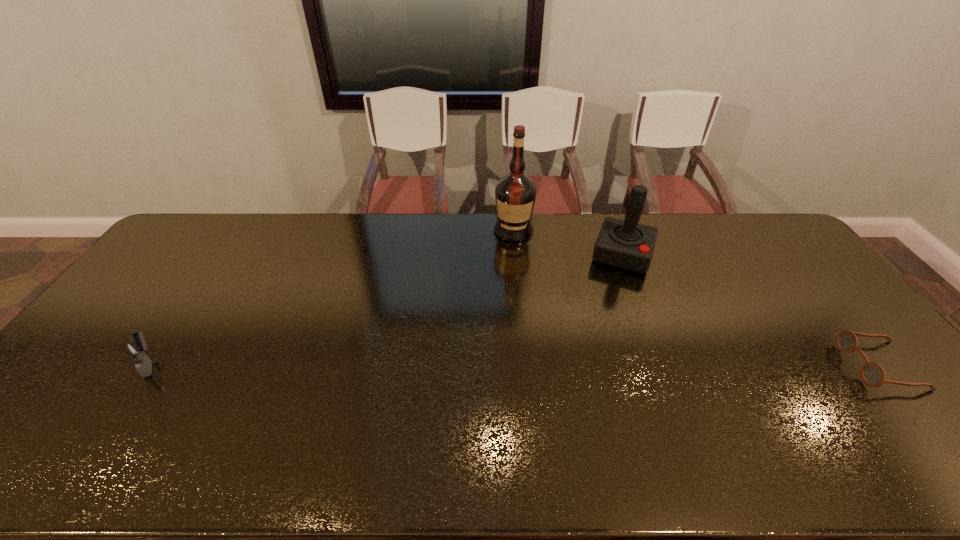
The width and height of the screenshot is (960, 540). Identify the location of the leftmost object. coord(137,350).

This screenshot has width=960, height=540. In order to click on the second shortest object in this screenshot , I will do `click(137, 350)`.

Where is `the shortest object`? Image resolution: width=960 pixels, height=540 pixels. the shortest object is located at coordinates (872, 374).

What are the coordinates of `the rightmost object` in the screenshot? It's located at (872, 374).

Where is `the third object from left to right`? The width and height of the screenshot is (960, 540). the third object from left to right is located at coordinates (626, 244).

At what (x,y) coordinates should I click in order to perform the action: click on the third shortest object. Please return your answer as a coordinate pair (x, y). Image resolution: width=960 pixels, height=540 pixels. Looking at the image, I should click on (626, 244).

Find the location of a particular element. liquor is located at coordinates (515, 194).

Find the location of a particular element. the tallest object is located at coordinates (515, 194).

At what (x,y) coordinates should I click in order to perform the action: click on free space located 0.400m on the back of the igniter. Please return your answer as a coordinate pair (x, y). The width and height of the screenshot is (960, 540). Looking at the image, I should click on (223, 256).

The height and width of the screenshot is (540, 960). What are the coordinates of `blank space located on the front-facing side of the rightmost object` in the screenshot? It's located at (778, 366).